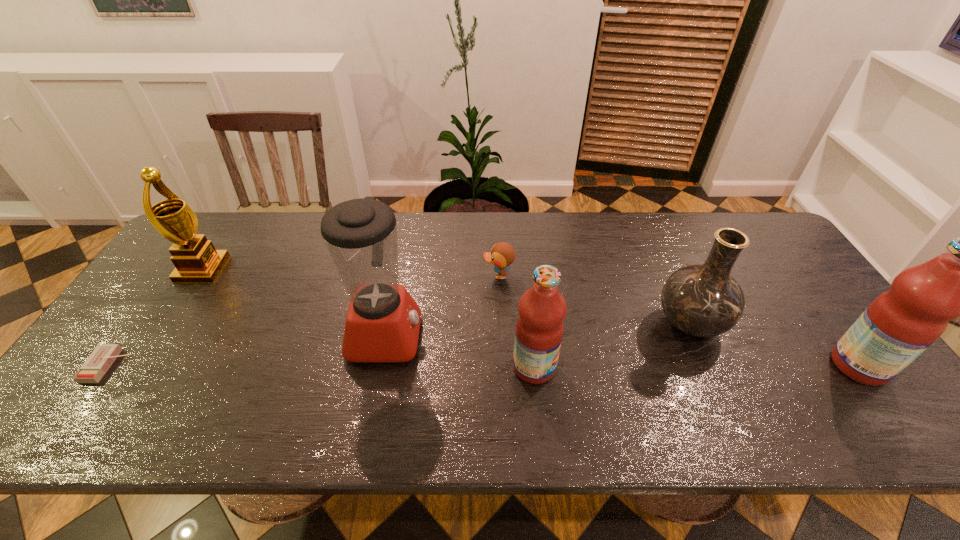
Locate an element on the screen. This screenshot has height=540, width=960. free region at the near left corner of the desktop is located at coordinates (132, 398).

Find the location of a particular element. This screenshot has width=960, height=540. free point between the award and the shortest object is located at coordinates (156, 318).

Image resolution: width=960 pixels, height=540 pixels. Find the location of `free spot between the third object from left to right and the left fruit juice`. free spot between the third object from left to right and the left fruit juice is located at coordinates 460,352.

Where is `free space that is in between the shortest object and the award`? free space that is in between the shortest object and the award is located at coordinates (156, 318).

The image size is (960, 540). Find the location of `vacant area that lies between the matchbox and the sixth tallest object`. vacant area that lies between the matchbox and the sixth tallest object is located at coordinates (302, 321).

Find the location of a particular element. This screenshot has width=960, height=540. empty location between the right fruit juice and the shortest object is located at coordinates (483, 366).

Locate an element on the screen. vacant area between the matchbox and the blender is located at coordinates (247, 350).

The height and width of the screenshot is (540, 960). I want to click on free space between the award and the matchbox, so click(x=156, y=318).

Locate an element on the screen. vacant area that lies between the rightmost object and the second object from right to left is located at coordinates (775, 345).

Choose which object is the third nearest neighbor to the taller fruit juice. Please provide its 2D coordinates. Your answer should be formatted as a tuple, i.e. [(x, y)], where the tuple contains the x and y coordinates of a point satisfying the conditions above.

[(502, 255)]